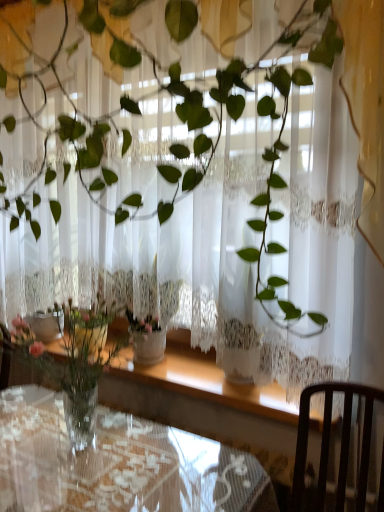
Question: Does dark wood chair at lower right have a smaller size compared to clear glass table at center?

Choices:
 (A) yes
 (B) no

Answer: (A)

Question: Considering the relative positions of dark wood chair at lower right and clear glass table at center in the image provided, is dark wood chair at lower right in front of clear glass table at center?

Choices:
 (A) no
 (B) yes

Answer: (B)

Question: Is dark wood chair at lower right wider than clear glass table at center?

Choices:
 (A) no
 (B) yes

Answer: (A)

Question: Does dark wood chair at lower right have a larger size compared to clear glass table at center?

Choices:
 (A) yes
 (B) no

Answer: (B)

Question: From a real-world perspective, is dark wood chair at lower right physically above clear glass table at center?

Choices:
 (A) yes
 (B) no

Answer: (A)

Question: Could you tell me if dark wood chair at lower right is turned towards clear glass table at center?

Choices:
 (A) yes
 (B) no

Answer: (B)

Question: Is the position of clear glass table at center more distant than that of dark wood chair at lower right?

Choices:
 (A) yes
 (B) no

Answer: (A)

Question: Considering the relative sizes of clear glass table at center and dark wood chair at lower right in the image provided, is clear glass table at center smaller than dark wood chair at lower right?

Choices:
 (A) no
 (B) yes

Answer: (A)

Question: From a real-world perspective, does clear glass table at center stand above dark wood chair at lower right?

Choices:
 (A) no
 (B) yes

Answer: (A)

Question: Is clear glass table at center positioned with its back to dark wood chair at lower right?

Choices:
 (A) no
 (B) yes

Answer: (A)

Question: From the image's perspective, is clear glass table at center located beneath dark wood chair at lower right?

Choices:
 (A) no
 (B) yes

Answer: (B)

Question: Is clear glass table at center outside dark wood chair at lower right?

Choices:
 (A) yes
 (B) no

Answer: (A)

Question: Is point (309, 392) closer or farther from the camera than point (188, 490)?

Choices:
 (A) farther
 (B) closer

Answer: (A)